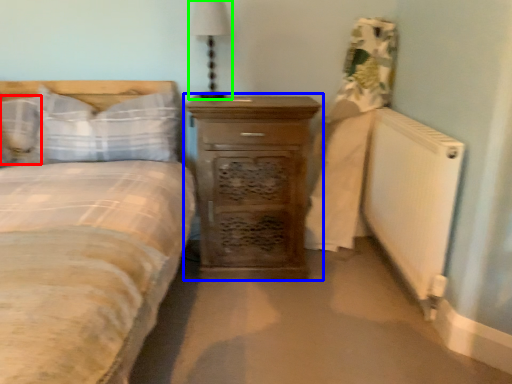
Question: Considering the real-world distances, which object is farthest from pillow (highlighted by a red box)? chest of drawers (highlighted by a blue box) or bedside lamp (highlighted by a green box)?

Choices:
 (A) chest of drawers
 (B) bedside lamp

Answer: (A)